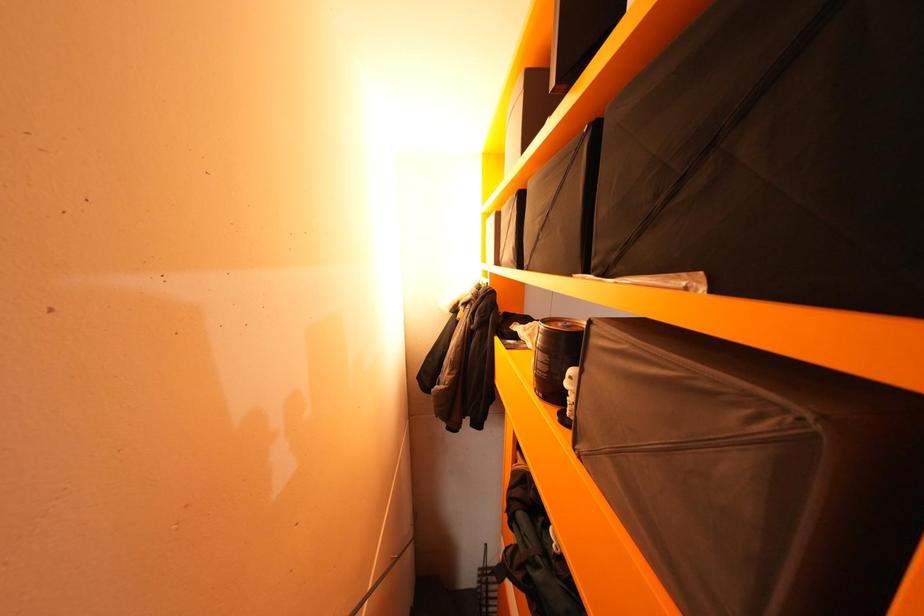
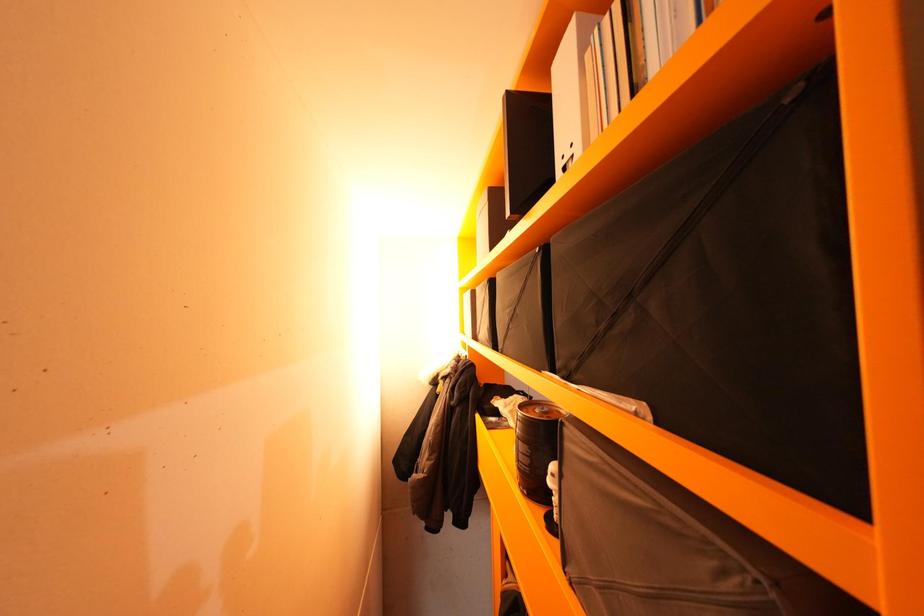
Which direction would the cameraman need to move to produce the second image?

The cameraman walked toward right, backward.